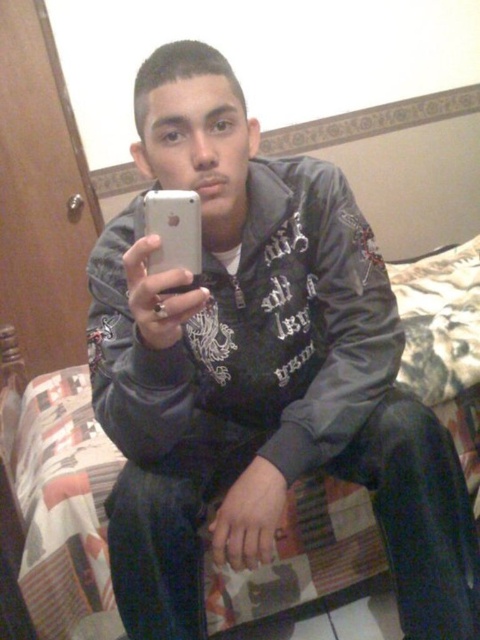
Does plaid fabric bed at center have a larger size compared to silver metallic phone at center?

Yes, plaid fabric bed at center is bigger than silver metallic phone at center.

Can you confirm if plaid fabric bed at center is positioned to the left of silver metallic phone at center?

Yes, plaid fabric bed at center is to the left of silver metallic phone at center.

Is point (308, 548) positioned behind point (200, 204)?

Yes, it is behind point (200, 204).

Find the location of a particular element. The width and height of the screenshot is (480, 640). plaid fabric bed at center is located at coordinates [61, 502].

Can you confirm if matte black leather jacket at center is taller than plaid fabric bed at center?

Yes, matte black leather jacket at center is taller than plaid fabric bed at center.

You are a GUI agent. You are given a task and a screenshot of the screen. Output one action in this format:
    pyautogui.click(x=<x>, y=<y>)
    Task: Click on the matte black leather jacket at center
    
    Given the screenshot: What is the action you would take?
    pyautogui.click(x=252, y=336)

Identify the location of matte black leather jacket at center. (252, 336).

Who is positioned more to the left, matte black leather jacket at center or silver metallic phone at center?

silver metallic phone at center

Who is lower down, matte black leather jacket at center or silver metallic phone at center?

matte black leather jacket at center is lower down.

The width and height of the screenshot is (480, 640). Find the location of `matte black leather jacket at center`. matte black leather jacket at center is located at coordinates (252, 336).

Identify the location of matte black leather jacket at center. (252, 336).